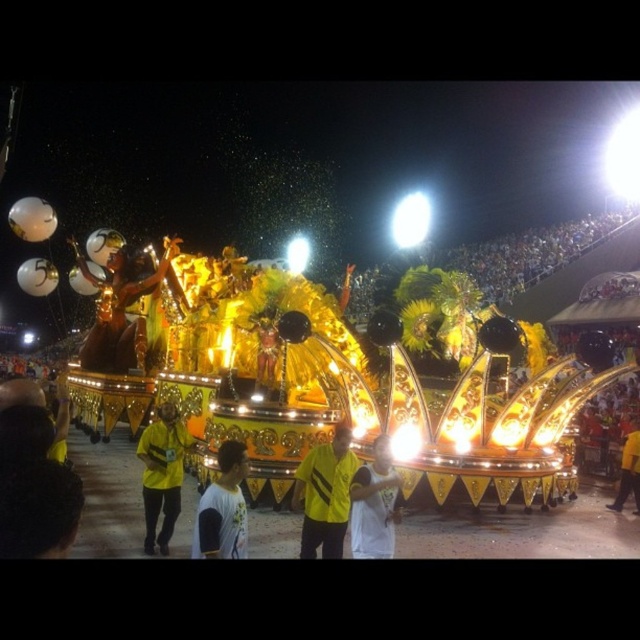
Question: Does gold metallic statue at center appear on the left side of white jersey at center?

Choices:
 (A) yes
 (B) no

Answer: (A)

Question: Does white jersey at center appear over white matte shirt at center?

Choices:
 (A) yes
 (B) no

Answer: (A)

Question: Which point is closer to the camera taking this photo?

Choices:
 (A) (636, 445)
 (B) (42, 477)

Answer: (B)

Question: From the image, what is the correct spatial relationship of yellow fabric shirt at center in relation to yellow fabric person at lower right?

Choices:
 (A) right
 (B) left

Answer: (B)

Question: Considering the real-world distances, which object is closest to the yellow fabric shirt at center?

Choices:
 (A) yellow fabric person at lower left
 (B) yellow matte shirt at center

Answer: (B)

Question: Based on their relative distances, which object is nearer to the white matte shirt at center?

Choices:
 (A) yellow fabric person at lower right
 (B) yellow fabric shirt at center

Answer: (B)